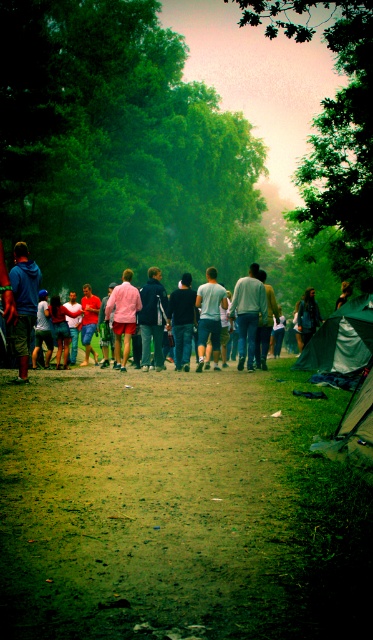
Can you confirm if light blue jeans at center is taller than pink fabric pants at center?

In fact, light blue jeans at center may be shorter than pink fabric pants at center.

Can you confirm if light blue jeans at center is smaller than pink fabric pants at center?

Indeed, light blue jeans at center has a smaller size compared to pink fabric pants at center.

Describe the element at coordinates (249, 312) in the screenshot. I see `light blue jeans at center` at that location.

Identify the location of light blue jeans at center. This screenshot has height=640, width=373. (x=249, y=312).

Find the location of `dark blue jeans at center`. dark blue jeans at center is located at coordinates (182, 321).

Who is more distant from viewer, (x=176, y=342) or (x=305, y=314)?

The point (x=305, y=314) is behind.

The height and width of the screenshot is (640, 373). In order to click on dark blue jeans at center in this screenshot , I will do `click(182, 321)`.

Where is `green canvas tent at lower right`? The image size is (373, 640). green canvas tent at lower right is located at coordinates (352, 426).

Can you confirm if green canvas tent at lower right is thinner than dark brown leather jacket at center?

Indeed, green canvas tent at lower right has a lesser width compared to dark brown leather jacket at center.

Where is `green canvas tent at lower right`? This screenshot has width=373, height=640. green canvas tent at lower right is located at coordinates (352, 426).

Find the location of a particular element. Image resolution: width=373 pixels, height=640 pixels. green canvas tent at lower right is located at coordinates tap(352, 426).